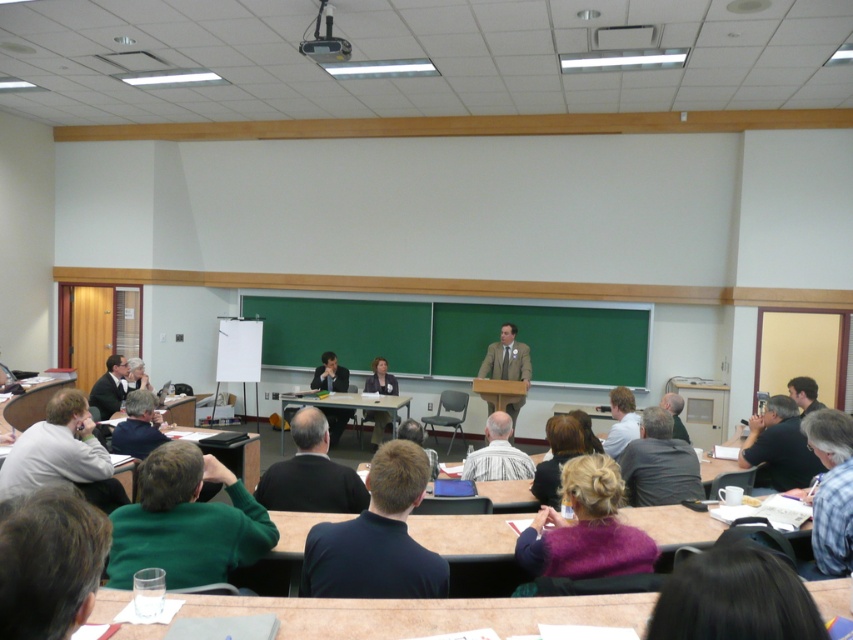
From the picture: You are a photographer standing in the back of the classroom. You want to take a photo of the light gray shirt at lower left and the dark gray sweater at lower left. Which one will be fully visible in the photo if they are both in the same frame?

The dark gray sweater at lower left will be fully visible because the light gray shirt at lower left is positioned under it and might be partially hidden.

You are organizing a coat rack for participants in the classroom. You have two sweaters to hang side by side on a rack that can only accommodate a total width of 1 meter. The green sweater at lower left and the dark gray sweater at center are the only ones left. Can both sweaters fit on the rack without overlapping?

The green sweater at lower left has a lesser width compared to the dark gray sweater at center. If the dark gray sweater at center is wider than the green sweater at lower left, but their combined widths must be less than or equal to 1 meter to fit. However, since the exact widths aren